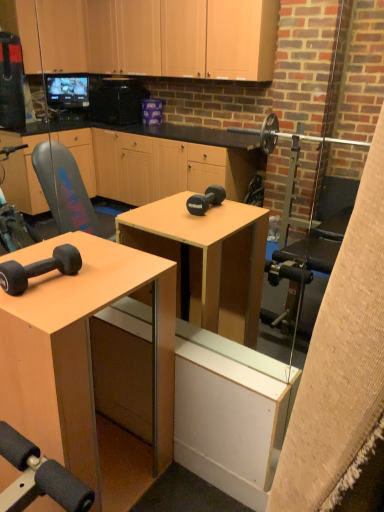
Locate an element on the screen. The height and width of the screenshot is (512, 384). free point above matte wood desk at center (from a real-world perspective) is located at coordinates (76, 278).